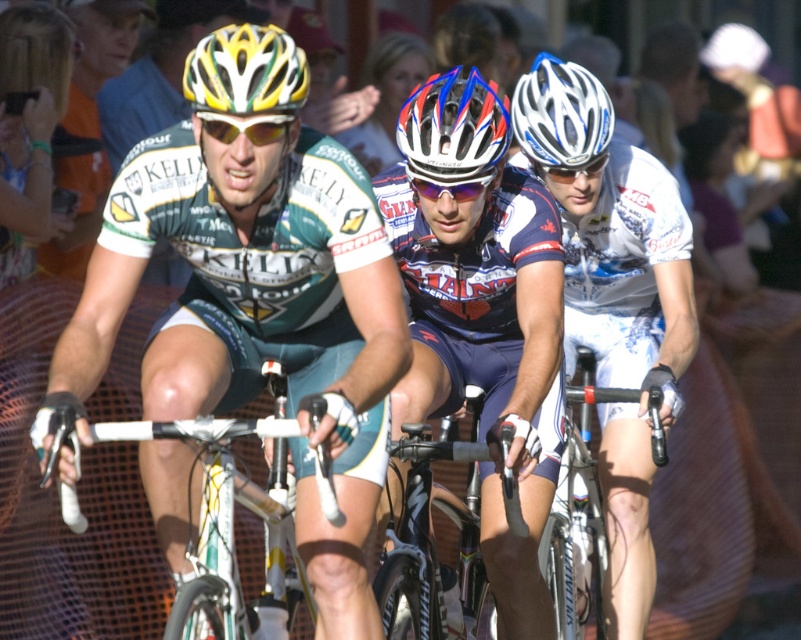
Question: Which object is the closest to the white reflective lens at center?

Choices:
 (A) green jersey at center
 (B) yellow-green matte helmet at center

Answer: (A)

Question: Estimate the real-world distances between objects in this image. Which object is closer to the shiny metallic bicycle at center?

Choices:
 (A) white glossy bicycle handlebars at center
 (B) green jersey at center

Answer: (A)

Question: Observing the image, what is the correct spatial positioning of shiny metallic bicycle at center in reference to yellow matte bicycle helmet at upper center?

Choices:
 (A) right
 (B) left

Answer: (A)

Question: Can you confirm if yellow matte bicycle helmet at upper center is positioned to the left of white matte bicycle helmet at center?

Choices:
 (A) no
 (B) yes

Answer: (B)

Question: Is white reflective lens at center below blue reflective lens at center?

Choices:
 (A) yes
 (B) no

Answer: (A)

Question: Which object is positioned farthest from the blue reflective lens at center?

Choices:
 (A) shiny metallic bicycle at center
 (B) white/blue/red glossy bicycle helmet at center
 (C) green jersey at center

Answer: (C)